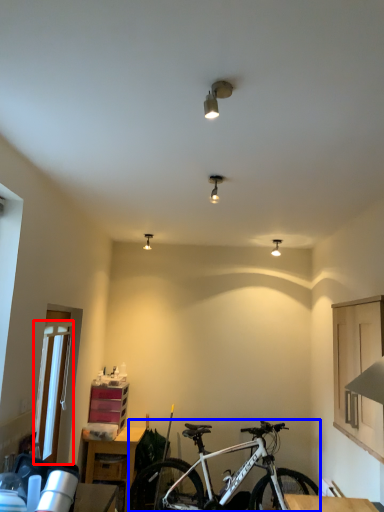
Question: Which object appears closest to the camera in this image, glass door (highlighted by a red box) or bicycle (highlighted by a blue box)?

Choices:
 (A) glass door
 (B) bicycle

Answer: (A)